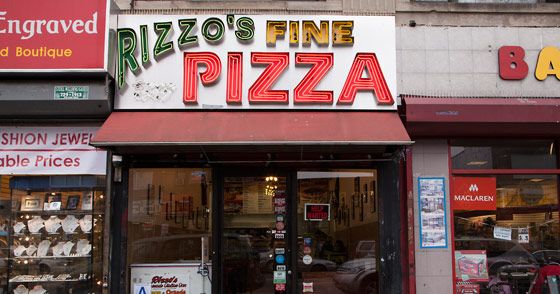
You are a GUI agent. You are given a task and a screenshot of the screen. Output one action in this format:
    pyautogui.click(x=<x>, y=<y>)
    Task: Click on the wall
    Image resolution: width=560 pixels, height=294 pixels.
    Given the screenshot: What is the action you would take?
    pyautogui.click(x=455, y=84)